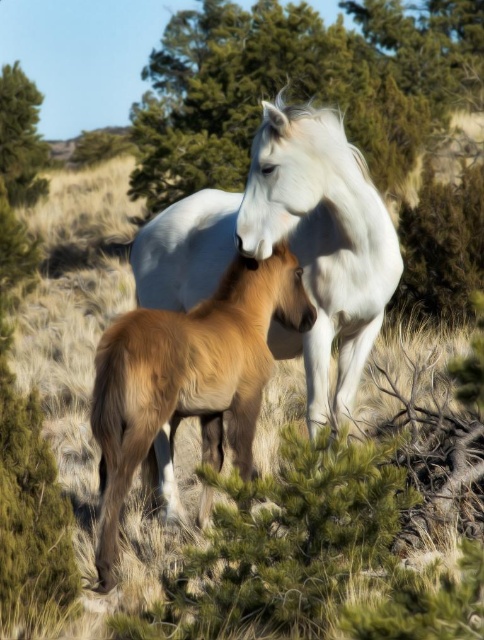
Question: Can you confirm if green leafy tree at upper center is smaller than white glossy horse at center?

Choices:
 (A) yes
 (B) no

Answer: (B)

Question: Which object appears farthest from the camera in this image?

Choices:
 (A) green leafy tree at upper left
 (B) brown fuzzy foal at center
 (C) green leafy tree at upper center

Answer: (A)

Question: Which of these objects is positioned closest to the white glossy horse at center?

Choices:
 (A) green leafy tree at upper center
 (B) brown fuzzy foal at center

Answer: (B)

Question: Observing the image, what is the correct spatial positioning of green leafy tree at upper center in reference to white glossy horse at center?

Choices:
 (A) above
 (B) below

Answer: (A)

Question: Estimate the real-world distances between objects in this image. Which object is closer to the green leafy tree at upper left?

Choices:
 (A) white glossy horse at center
 (B) brown fuzzy foal at center

Answer: (A)

Question: Is green leafy tree at upper center above green leafy tree at upper left?

Choices:
 (A) yes
 (B) no

Answer: (A)